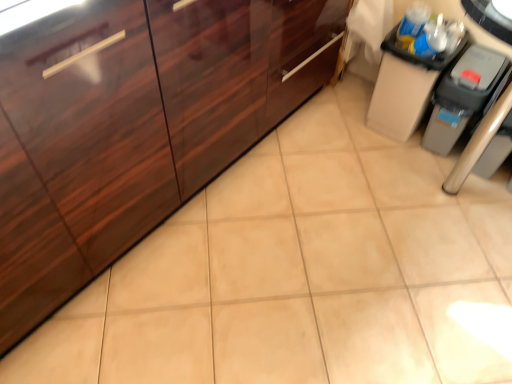
Locate an element on the screen. empty space that is ontop of gray plastic trash can at right is located at coordinates (482, 60).